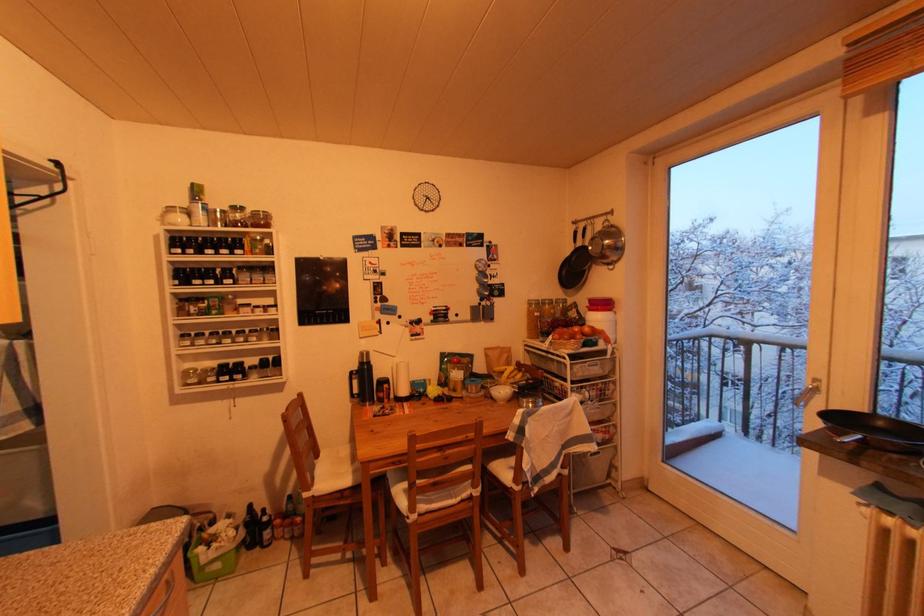
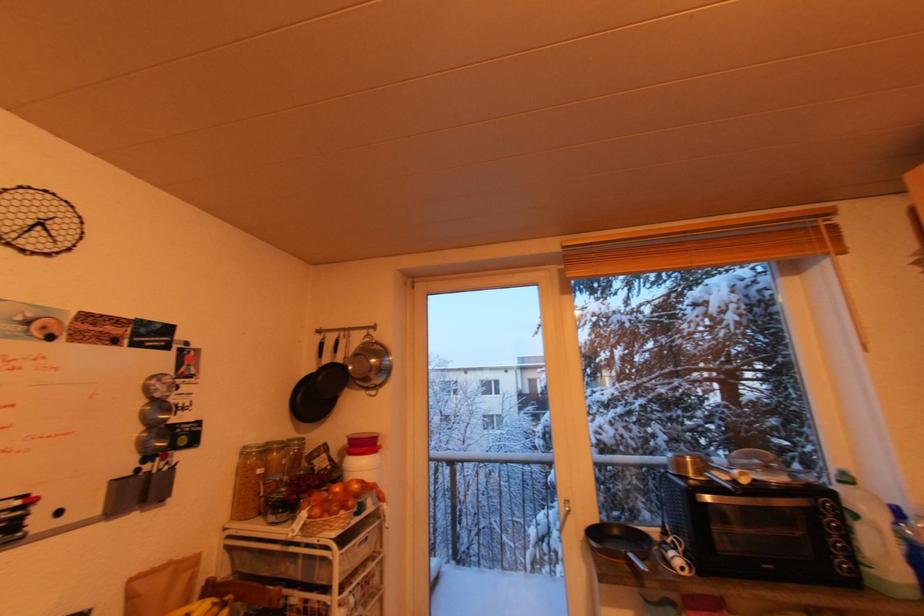
The images are taken continuously from a first-person perspective. In which direction is your viewpoint rotating?

The rotation direction of the camera is right-up.